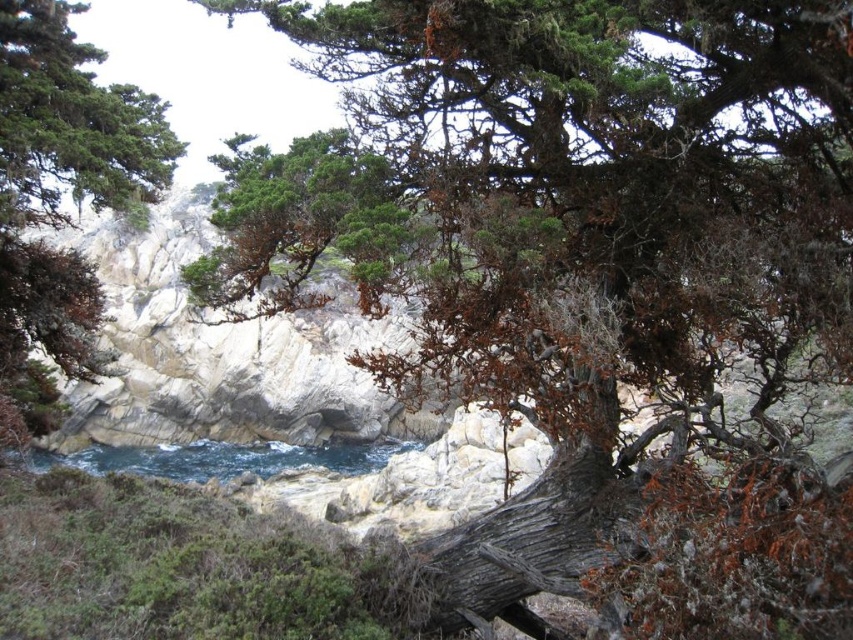
You are an artist planning to paint this coastal landscape. You want to place a small boat in the scene such that it is positioned to the right of the green matte tree at upper left. Based on the given coordinates, where should you place the boat in terms of its 2D coordinates?

The green matte tree at upper left is located at coordinates (70, 122). To place the boat to the right of it, the boat should be positioned at a coordinate where the x value is greater than 0.192 while keeping the y value around 0.083.

You are standing on the rocky shoreline and want to take a photo of the green matte tree at upper left and the blue water at center. Which object should you position to your left side to include both in the frame?

To include both the green matte tree at upper left and the blue water at center in the frame, position the blue water at center to your left side since the green matte tree at upper left is to the right of it.